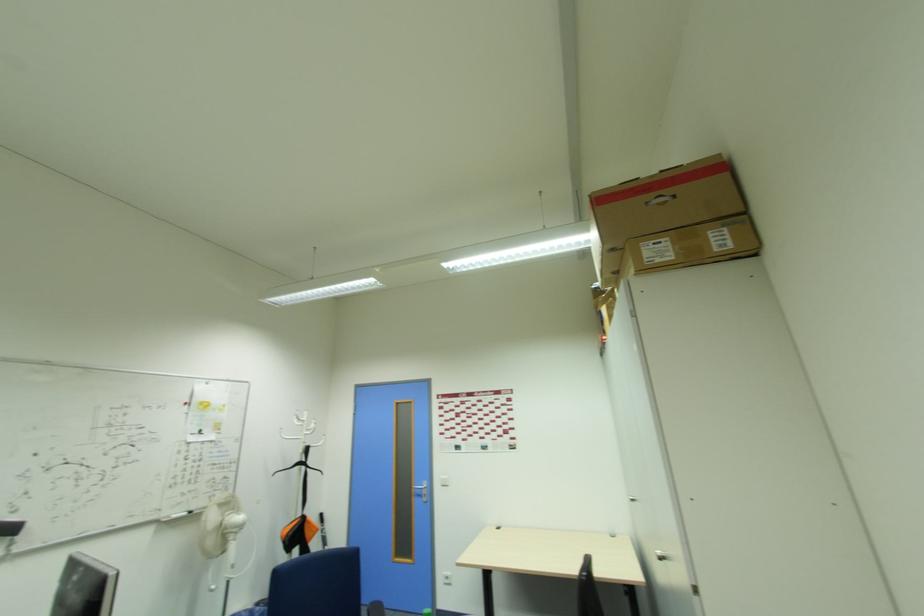
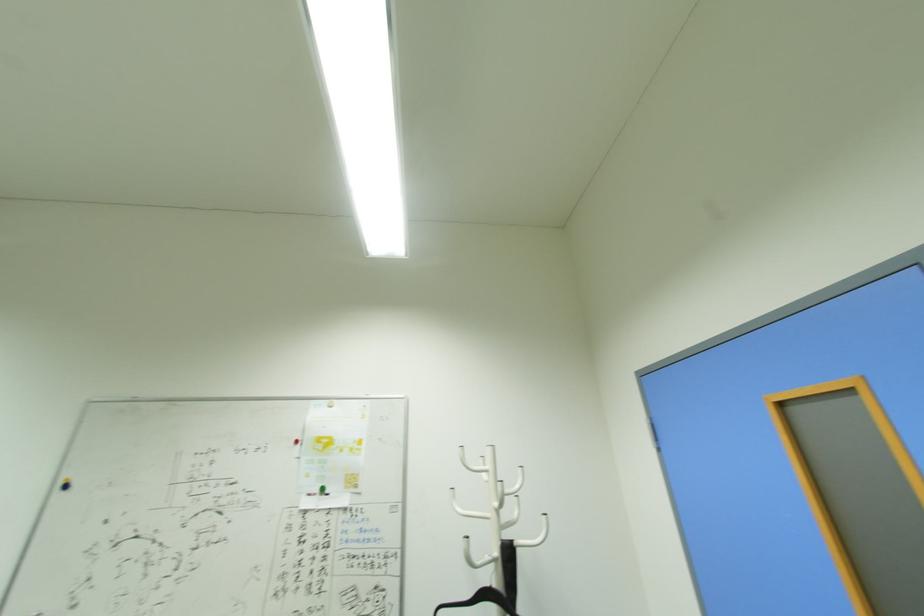
In the second image, find the point that corresponds to [310,414] in the first image.

(493, 451)